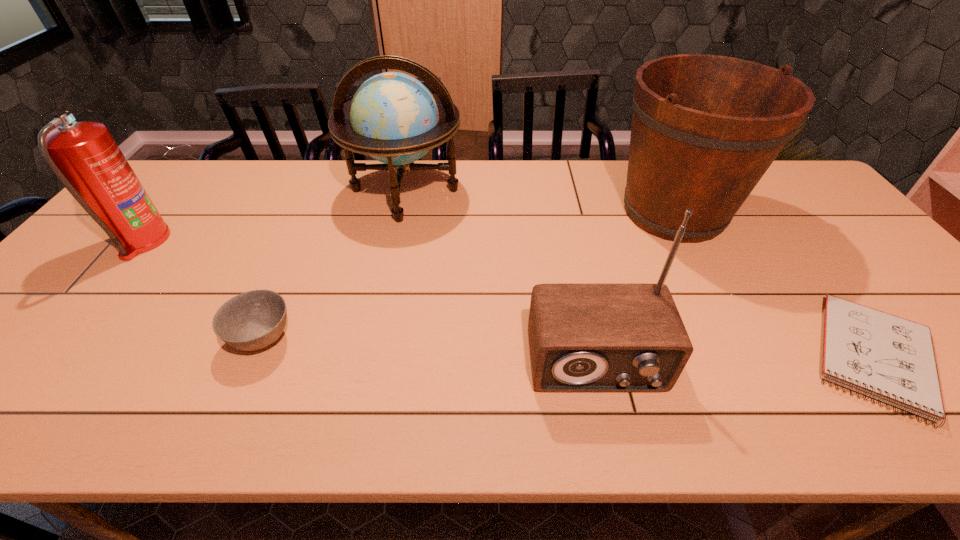
Where is `globe`? globe is located at coordinates (393, 117).

Identify the location of bucket. The height and width of the screenshot is (540, 960). tap(705, 128).

At what (x,y) coordinates should I click in order to perform the action: click on the leftmost object. Please return your answer as a coordinate pair (x, y). Looking at the image, I should click on (85, 158).

Locate an element on the screen. The image size is (960, 540). radio receiver is located at coordinates (590, 337).

Where is `the fifth tallest object`? the fifth tallest object is located at coordinates [x=253, y=320].

Identify the location of free region located on the surface of the globe. The image size is (960, 540). (375, 332).

At what (x,y) coordinates should I click in order to perform the action: click on vacant space located on the front of the bucket. Please return your answer as a coordinate pair (x, y). Looking at the image, I should click on (705, 272).

Find the location of a particular element. This screenshot has height=540, width=960. vacant space located 0.330m on the instruction side of the fire extinguisher is located at coordinates (283, 241).

What are the coordinates of `vacant space located 0.390m on the back of the fifth tallest object` in the screenshot? It's located at (317, 215).

The height and width of the screenshot is (540, 960). Identify the location of globe at the far edge. (393, 117).